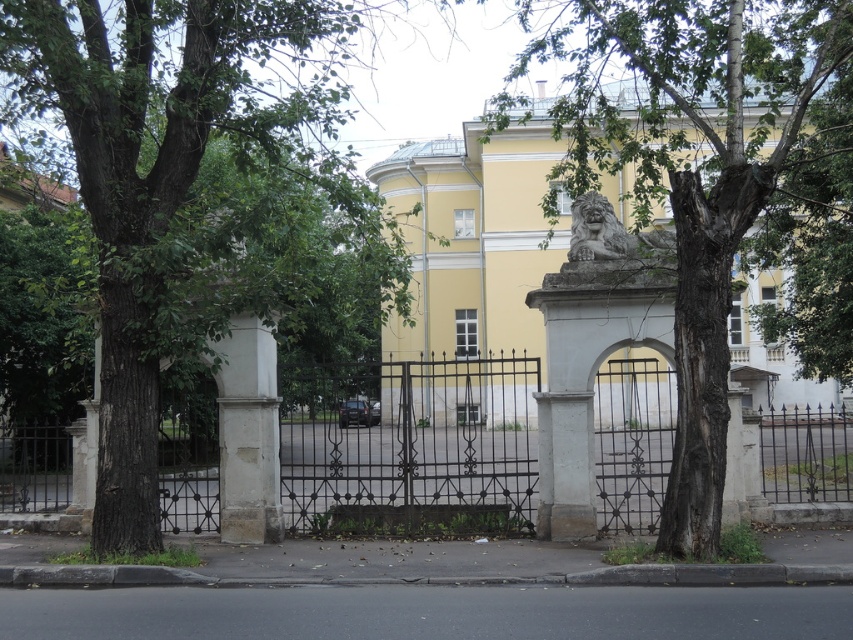
You are standing in front of the grand entrance gate and want to walk towards the yellow building with white trimmings. Which direction should you go relative to the green leafy tree at left and the green leafy tree at center?

You should walk towards the right of the green leafy tree at left and the green leafy tree at center since the green leafy tree at left is positioned to the left of the green leafy tree at center, meaning the path to the yellow building is likely between them or to their right side.

You are a gardener who needs to trim the branches of the green leafy tree at center so that they do not block the view of the polished stone lion at center. Based on their sizes, which object should you focus on trimming more to ensure the lion is visible?

The green leafy tree at center has a larger size compared to the polished stone lion at center, so you should focus on trimming its branches more to ensure the lion is visible.

You are a landscape architect planning to add more greenery to the area in front of the yellow building with white trimmings. You have two green leafy trees already present, the green leafy tree at left and the green leafy tree at center. Which of these trees is larger in size?

The green leafy tree at center is larger in size because it occupies more space than the green leafy tree at left.